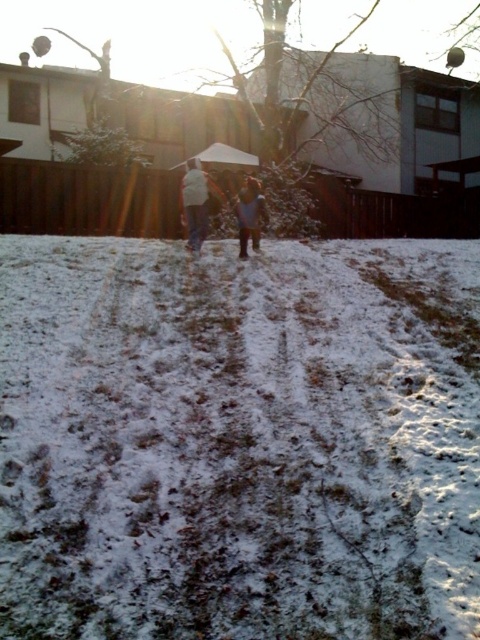
You are a delivery person trying to deliver a package to the matte white hoodie at center and the white matte jacket at center. The minimum distance required between packages for the delivery drone to distinguish them is 2 inches. Can the drone deliver both packages separately?

The matte white hoodie at center is only 1.35 inches from the white matte jacket at center, which is less than the required 2 inches. Therefore, the drone cannot distinguish between them and deliver the packages separately.